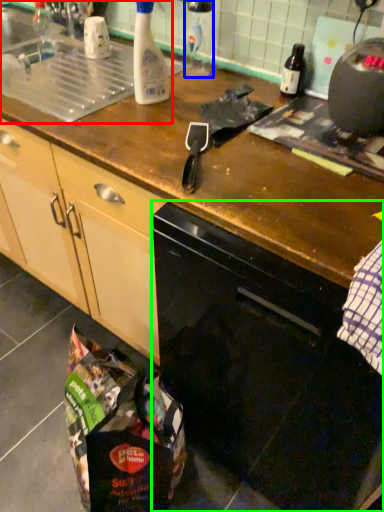
Question: Which is nearer to the sink (highlighted by a red box)? bottle (highlighted by a blue box) or home appliance (highlighted by a green box).

Choices:
 (A) bottle
 (B) home appliance

Answer: (A)